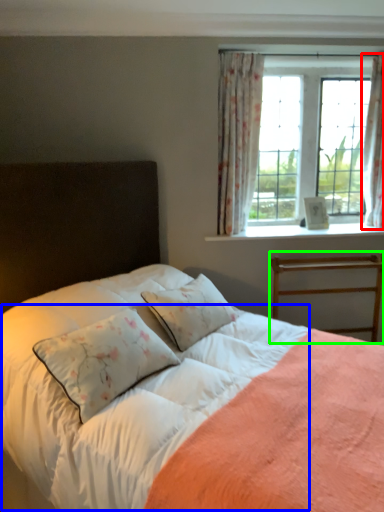
Question: Estimate the real-world distances between objects in this image. Which object is farther from curtain (highlighted by a red box), sheet (highlighted by a blue box) or bed frame (highlighted by a green box)?

Choices:
 (A) sheet
 (B) bed frame

Answer: (A)